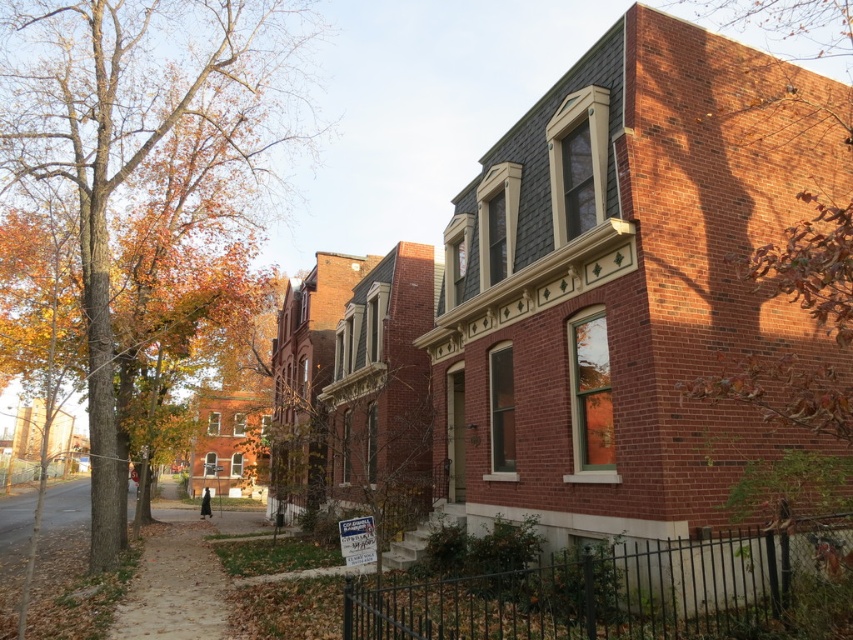
Question: Which point appears farthest from the camera in this image?

Choices:
 (A) (149, 576)
 (B) (47, 125)

Answer: (B)

Question: Is brown leafy tree at right below brown dirt pavement at lower left?

Choices:
 (A) yes
 (B) no

Answer: (B)

Question: Which point appears farthest from the camera in this image?

Choices:
 (A) (154, 547)
 (B) (157, 29)
 (C) (744, 273)

Answer: (B)

Question: Does brown leafy tree at right lie behind brown dirt pavement at lower left?

Choices:
 (A) yes
 (B) no

Answer: (B)

Question: From the image, what is the correct spatial relationship of autumn leaves at left in relation to brown dirt pavement at lower left?

Choices:
 (A) right
 (B) left

Answer: (B)

Question: Based on their relative distances, which object is farther from the autumn leaves at left?

Choices:
 (A) brown leafy tree at right
 (B) brown dirt pavement at lower left

Answer: (A)